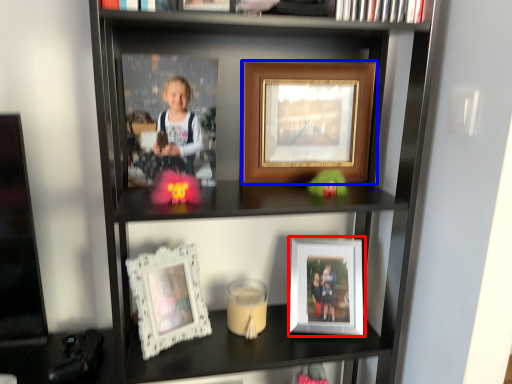
Question: Among these objects, which one is nearest to the camera, picture frame (highlighted by a red box) or picture frame (highlighted by a blue box)?

Choices:
 (A) picture frame
 (B) picture frame

Answer: (B)